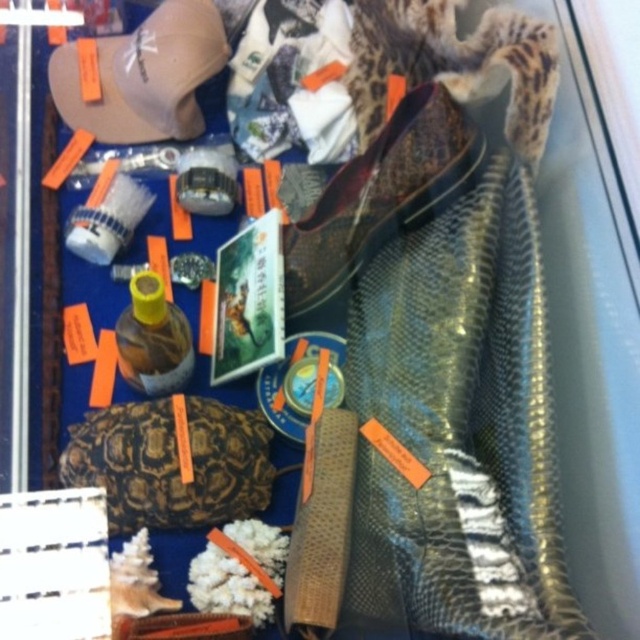
You are standing 40 inches away from the camera. Is the point at coordinates point (180,525) closer to you than the camera?

The distance of point (180,525) from camera is 36.34 inches, so yes, the point at coordinates point (180,525) is closer to you than the camera since it is only 36.34 inches away compared to your 40 inches distance.